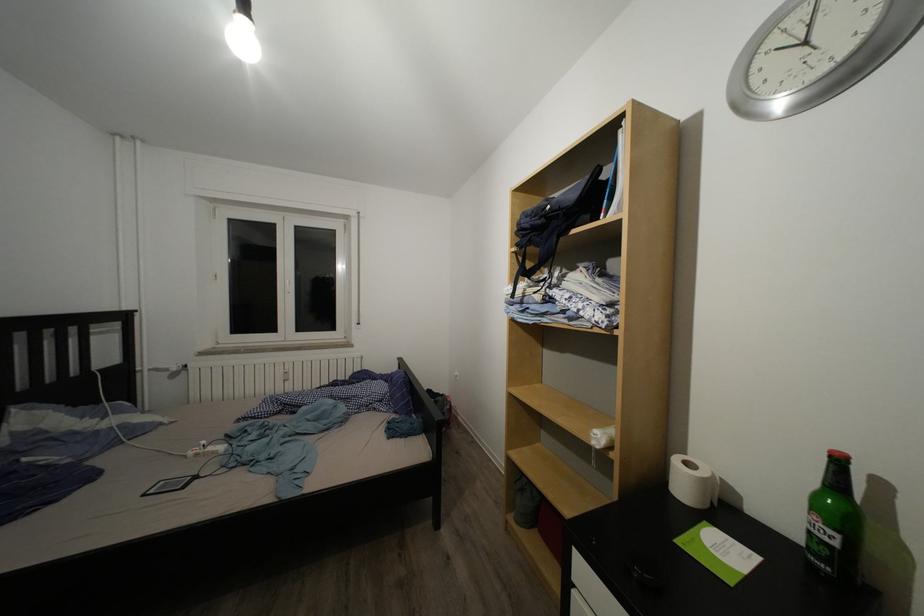
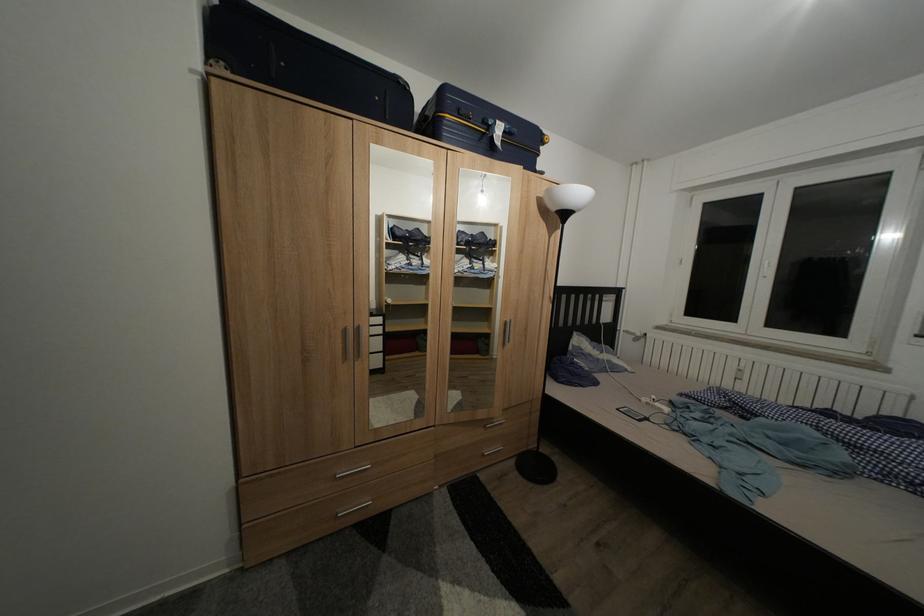
Question: The first image is from the beginning of the video and the second image is from the end. How did the camera likely rotate when shooting the video?

Choices:
 (A) Left
 (B) Right
 (C) Up
 (D) Down

Answer: (A)